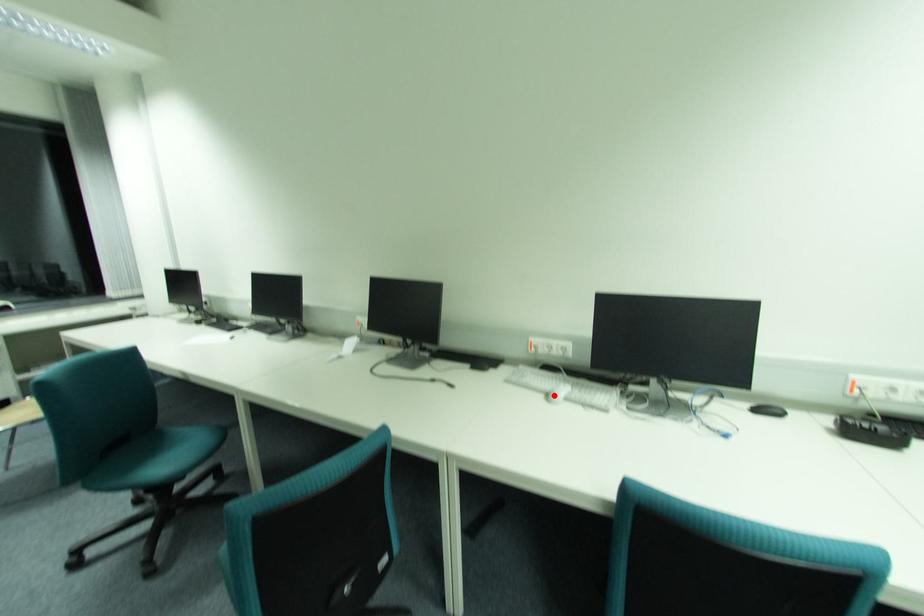
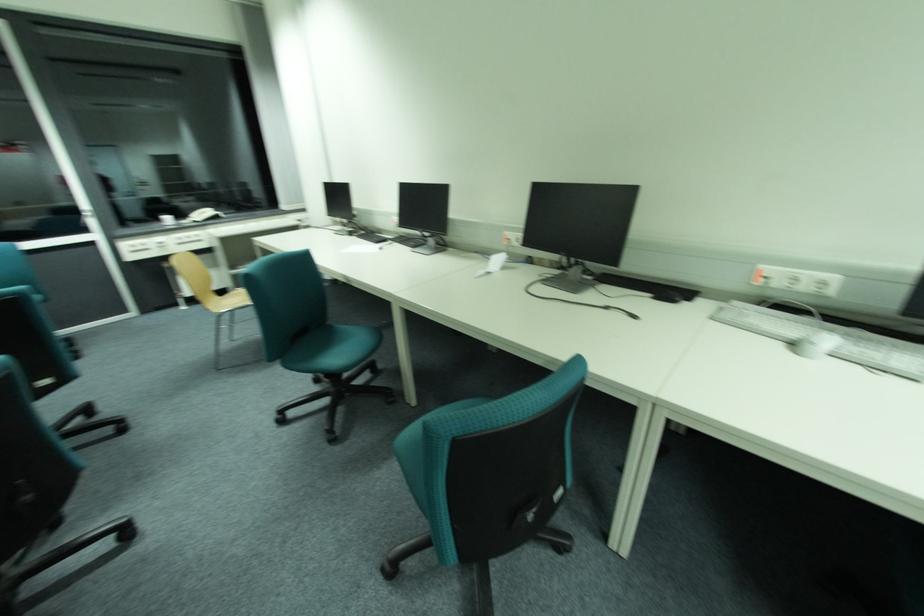
Question: I am providing you with two images of the same scene from different viewpoints. A red point is marked on the first image. Can you still see the location of the red point in image 2?

Choices:
 (A) Yes
 (B) No

Answer: (A)